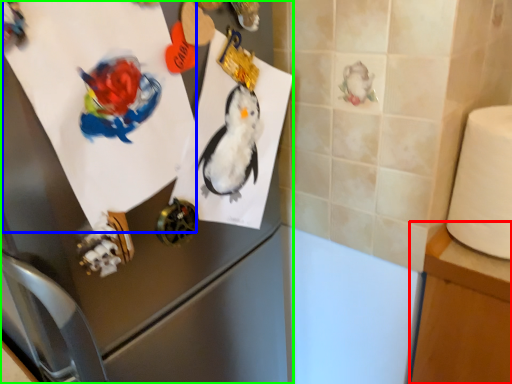
Question: Considering the real-world distances, which object is farthest from table (highlighted by a red box)? paper (highlighted by a blue box) or appliance (highlighted by a green box)?

Choices:
 (A) paper
 (B) appliance

Answer: (A)